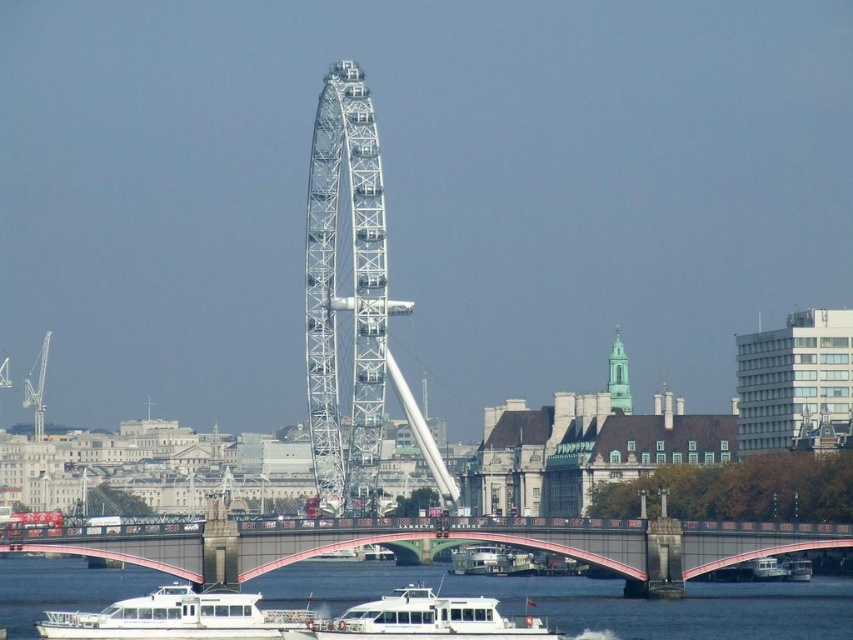
Question: Which of the following is the closest to the observer?

Choices:
 (A) metallic pink bridge at center
 (B) white metallic ferris wheel at center
 (C) white glossy boat at lower center

Answer: (A)

Question: Which object is farther from the camera taking this photo?

Choices:
 (A) white matte boat at center
 (B) white glossy boat at lower center

Answer: (B)

Question: Observing the image, what is the correct spatial positioning of white metallic ferris wheel at center in reference to white matte boat at center?

Choices:
 (A) above
 (B) below

Answer: (A)

Question: Is white metallic ferris wheel at center positioned at the back of white matte boat at lower center?

Choices:
 (A) no
 (B) yes

Answer: (B)

Question: Estimate the real-world distances between objects in this image. Which object is farther from the white glossy boat at lower center?

Choices:
 (A) metallic pink bridge at center
 (B) white matte boat at lower center
 (C) white matte boat at center
 (D) white metallic ferris wheel at center

Answer: (D)

Question: In this image, where is white matte boat at lower center located relative to white glossy boat at center?

Choices:
 (A) left
 (B) right

Answer: (A)